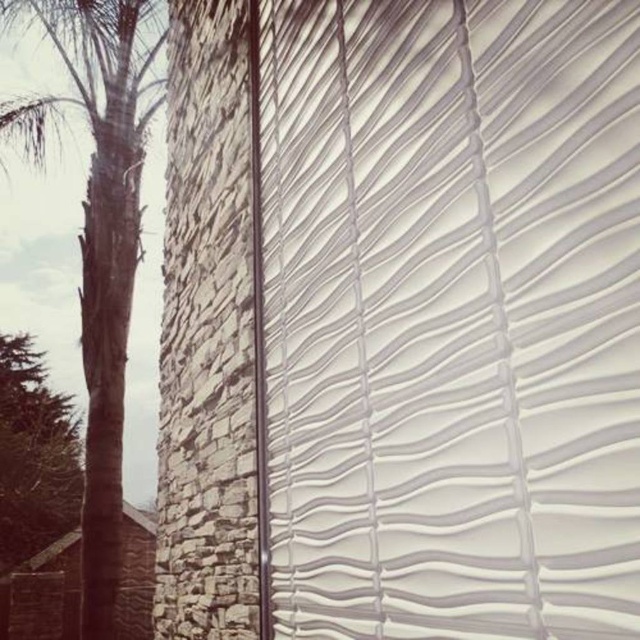
You are standing in front of the building and notice the white textured blind at center and the green leafy tree at left. Which object is positioned more to the right side of the scene?

The white textured blind at center is positioned to the right of the green leafy tree at left, so it is more to the right side of the scene.

You are an interior designer planning to hang a new artwork between the white textured blind at center and the brown textured palm tree at left. Given their widths, which object should the artwork be placed closer to to ensure it doesn not block either object?

The artwork should be placed closer to the white textured blind at center because it is thinner than the brown textured palm tree at left, allowing more space between them without blocking either object.